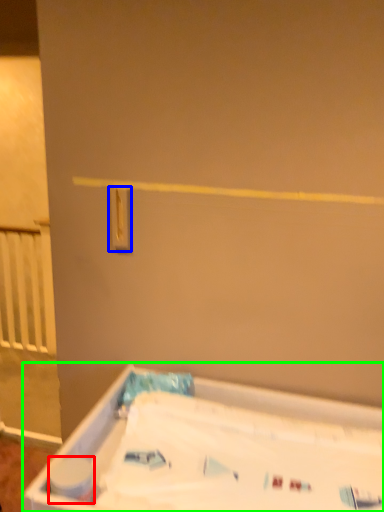
Question: Which is farther away from toilet paper (highlighted by a red box)? light switch (highlighted by a blue box) or bathtub (highlighted by a green box)?

Choices:
 (A) light switch
 (B) bathtub

Answer: (A)